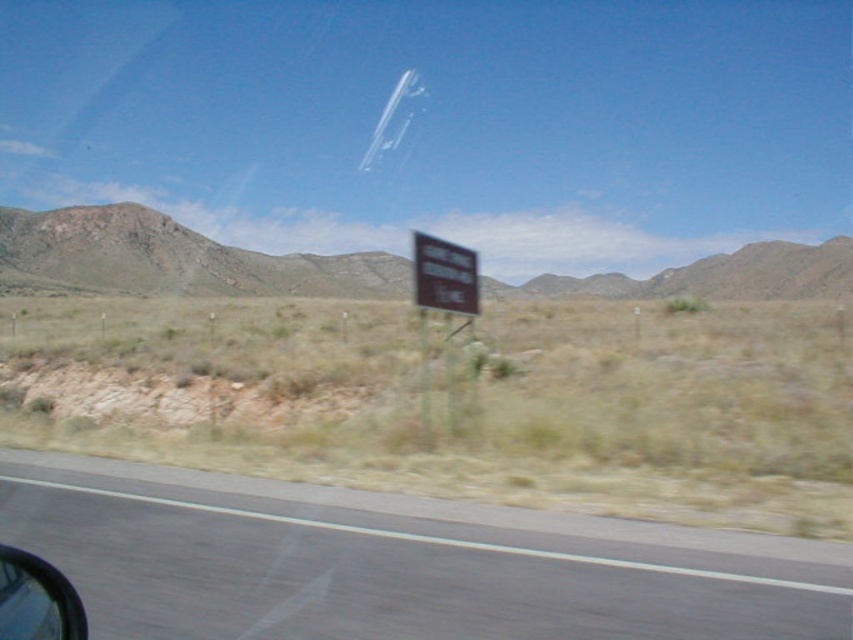
You are a passenger in the car and want to read the brown matte sign at center through the transparent plastic car window at lower left. Is the sign visible through the window?

The brown matte sign at center might be wider than transparent plastic car window at lower left, so it might not be fully visible through the window.

You are a passenger in the car and looking out the side window. There is a point marked at coordinates (x=395, y=568). What object is located at that point?

The point at coordinates (x=395, y=568) indicates the black asphalt road at lower center.